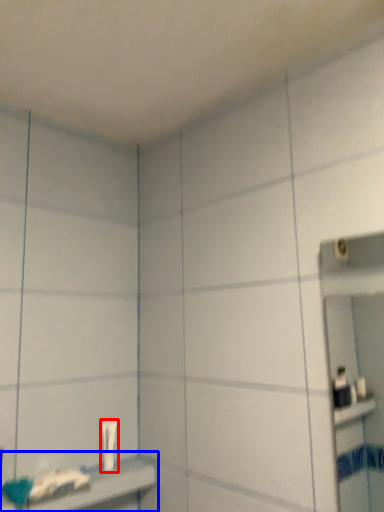
Question: Which point is further to the camera, toothpaste (highlighted by a red box) or shelf (highlighted by a blue box)?

Choices:
 (A) toothpaste
 (B) shelf

Answer: (A)